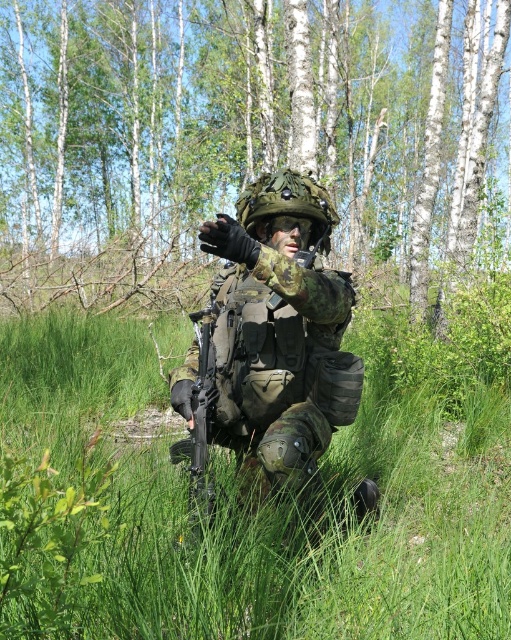
You are a drone operator trying to identify two points in a forest scene. The points are labeled as point 1 at coordinates (248, 262) and point 2 at (206, 390). Which point is closer to you?

Point 1 at coordinates (248, 262) is closer to the viewer than point 2 at (206, 390).

You are a drone operator controlling a drone that needs to land on a specific point in the forest. The point is located at coordinates point (320, 540). What is the object at that location?

The point (320, 540) corresponds to green matte grass at center.